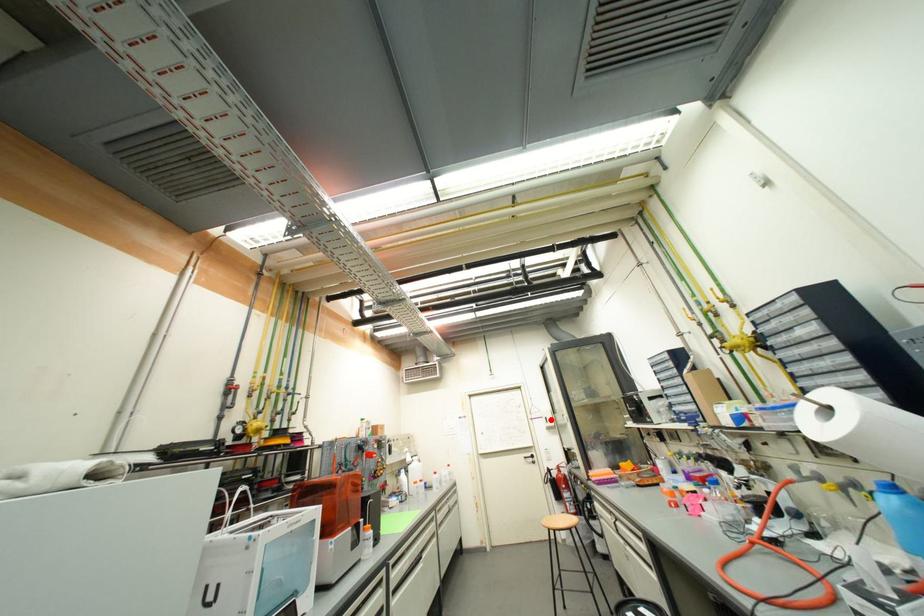
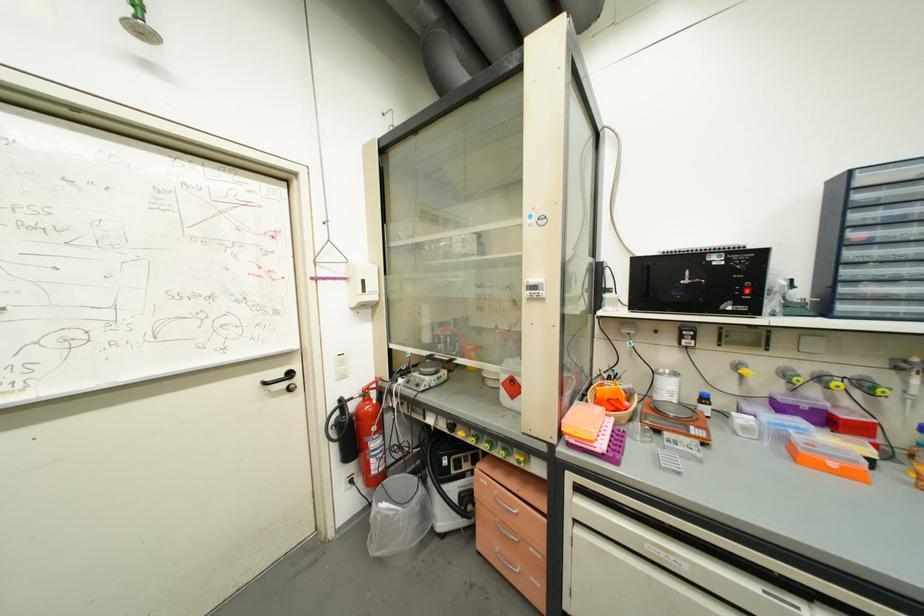
Question: A red point is marked in image1. In image2, is the corresponding 3D point closer to the camera or farther? Reply with the corresponding letter.

Choices:
 (A) The corresponding 3D point is closer.
 (B) The corresponding 3D point is farther.

Answer: (A)